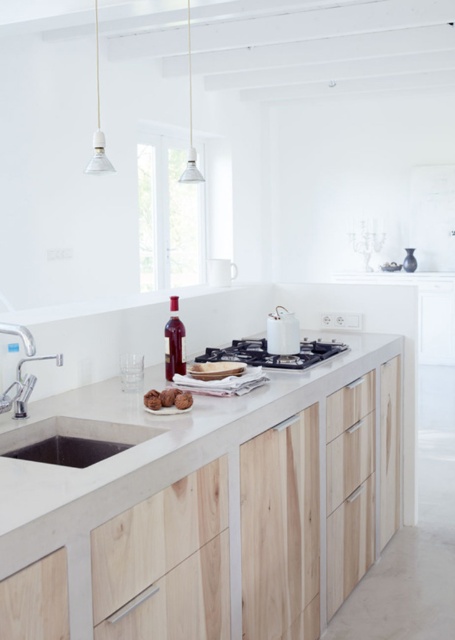
You are a kitchen designer trying to place a new appliance between the matte white sink at lower left and the matte concrete sink at lower left. Which sink should you consider for the appliance placement to ensure enough space?

The matte white sink at lower left has a larger size compared to the matte concrete sink at lower left, so you should place the appliance near the matte white sink at lower left to ensure enough space.

You are a chef preparing to wash dishes in the kitchen. You need to choose between the matte white sink at lower left and the matte concrete sink at lower left. Which sink is taller?

The matte white sink at lower left is taller than the matte concrete sink at lower left according to the description provided.